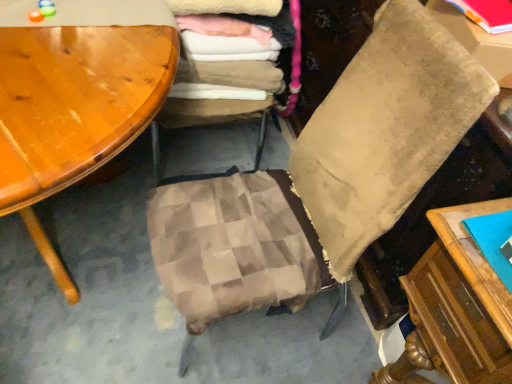
What is the approximate width of matte cardboard box at upper right?

The width of matte cardboard box at upper right is 8.93 inches.

This screenshot has width=512, height=384. Find the location of `matte red book at upper right`. matte red book at upper right is located at coordinates (487, 13).

This screenshot has width=512, height=384. What do you see at coordinates (221, 93) in the screenshot?
I see `plaid fabric cushion at center` at bounding box center [221, 93].

Identify the location of soft cotton laundry at center. (241, 40).

Is matte cardboard box at upper right placed right next to beige velvety pillow at center?

No, matte cardboard box at upper right is not in contact with beige velvety pillow at center.

Is matte cardboard box at upper right looking in the opposite direction of beige velvety pillow at center?

No, matte cardboard box at upper right is not facing away from beige velvety pillow at center.

Identify the location of table that is on the right side of beige velvety pillow at center. The image size is (512, 384). (477, 41).

Between matte cardboard box at upper right and beige velvety pillow at center, which one appears on the right side from the viewer's perspective?

Positioned to the right is matte cardboard box at upper right.

Is soft cotton laundry at center not close to matte cardboard box at upper right?

No, soft cotton laundry at center is not far away from matte cardboard box at upper right.

Locate an element on the screen. Image resolution: width=512 pixels, height=384 pixels. table that is in front of the soft cotton laundry at center is located at coordinates (477, 41).

Which object is wider, soft cotton laundry at center or matte cardboard box at upper right?

soft cotton laundry at center is wider.

Choose the correct answer: Is soft cotton laundry at center inside matte cardboard box at upper right or outside it?

soft cotton laundry at center cannot be found inside matte cardboard box at upper right.

Between matte red book at upper right and beige velvety pillow at center, which one has smaller size?

matte red book at upper right is smaller.

From the image's perspective, would you say matte red book at upper right is shown under beige velvety pillow at center?

Yes.

Is point (492, 6) positioned before point (304, 150)?

Yes, it is.

Can you see plaid fabric cushion at center touching matte cardboard box at upper right?

No, plaid fabric cushion at center is not touching matte cardboard box at upper right.

Is plaid fabric cushion at center thinner than matte cardboard box at upper right?

Incorrect, the width of plaid fabric cushion at center is not less than that of matte cardboard box at upper right.

Between plaid fabric cushion at center and matte cardboard box at upper right, which one is positioned in front?

matte cardboard box at upper right is more forward.

Is beige velvety pillow at center turned away from matte red book at upper right?

That's not correct — beige velvety pillow at center is not looking away from matte red book at upper right.

Locate an element on the screen. book above the beige velvety pillow at center (from a real-world perspective) is located at coordinates (487, 13).

Can you confirm if beige velvety pillow at center is smaller than matte red book at upper right?

No, beige velvety pillow at center is not smaller than matte red book at upper right.

From the image's perspective, is beige velvety pillow at center located above or below matte red book at upper right?

From the image's perspective, beige velvety pillow at center appears above matte red book at upper right.

Measure the distance from matte cardboard box at upper right to matte red book at upper right.

1.66 inches.

Is matte cardboard box at upper right looking in the opposite direction of matte red book at upper right?

matte cardboard box at upper right does not have its back to matte red book at upper right.

Is point (447, 14) positioned in front of point (477, 0)?

No, (447, 14) is behind (477, 0).

From the picture: Considering the relative sizes of matte cardboard box at upper right and matte red book at upper right in the image provided, is matte cardboard box at upper right smaller than matte red book at upper right?

No, matte cardboard box at upper right is not smaller than matte red book at upper right.

Does matte red book at upper right appear on the left side of plaid fabric cushion at center?

No.

Consider the image. Is matte red book at upper right beside plaid fabric cushion at center?

No, matte red book at upper right is not next to plaid fabric cushion at center.

In the scene shown: From a real-world perspective, is matte red book at upper right on top of plaid fabric cushion at center?

Yes, from a real-world perspective, matte red book at upper right is over plaid fabric cushion at center

In the scene shown: How much distance is there between matte red book at upper right and plaid fabric cushion at center?

A distance of 32.86 inches exists between matte red book at upper right and plaid fabric cushion at center.

In the image, there is a matte cardboard box at upper right. Find the location of `pillow above it (from the image's perspective)`. pillow above it (from the image's perspective) is located at coordinates (385, 130).

I want to click on table that is on the right side of soft cotton laundry at center, so click(477, 41).

Looking at the image, which one is located closer to beige velvety pillow at center, matte red book at upper right or soft cotton laundry at center?

Among the two, matte red book at upper right is located nearer to beige velvety pillow at center.

Considering their positions, is matte red book at upper right positioned closer to matte cardboard box at upper right than beige velvety pillow at center?

Based on the image, matte red book at upper right appears to be nearer to matte cardboard box at upper right.

Considering their positions, is plaid fabric cushion at center positioned further to soft cotton laundry at center than beige velvety pillow at center?

Among the two, beige velvety pillow at center is located further to soft cotton laundry at center.

From the image, which object appears to be nearer to matte cardboard box at upper right, plaid fabric cushion at center or soft cotton laundry at center?

Among the two, soft cotton laundry at center is located nearer to matte cardboard box at upper right.

When comparing their distances from soft cotton laundry at center, does plaid fabric cushion at center or matte cardboard box at upper right seem closer?

plaid fabric cushion at center lies closer to soft cotton laundry at center than the other object.

When comparing their distances from beige velvety pillow at center, does soft cotton laundry at center or matte red book at upper right seem further?

The object further to beige velvety pillow at center is soft cotton laundry at center.

From the image, which object appears to be nearer to soft cotton laundry at center, matte red book at upper right or plaid fabric cushion at center?

The object closer to soft cotton laundry at center is plaid fabric cushion at center.

Considering their positions, is matte cardboard box at upper right positioned closer to plaid fabric cushion at center than beige velvety pillow at center?

beige velvety pillow at center.

The image size is (512, 384). I want to click on pillow situated between plaid fabric cushion at center and matte red book at upper right from left to right, so click(x=385, y=130).

Locate an element on the screen. Image resolution: width=512 pixels, height=384 pixels. pillow between plaid fabric cushion at center and matte cardboard box at upper right in the horizontal direction is located at coordinates (385, 130).

What are the coordinates of `laundry located between plaid fabric cushion at center and matte cardboard box at upper right in the left-right direction` in the screenshot? It's located at (241, 40).

Where is `book between plaid fabric cushion at center and matte cardboard box at upper right in the horizontal direction`? This screenshot has height=384, width=512. book between plaid fabric cushion at center and matte cardboard box at upper right in the horizontal direction is located at coordinates (487, 13).